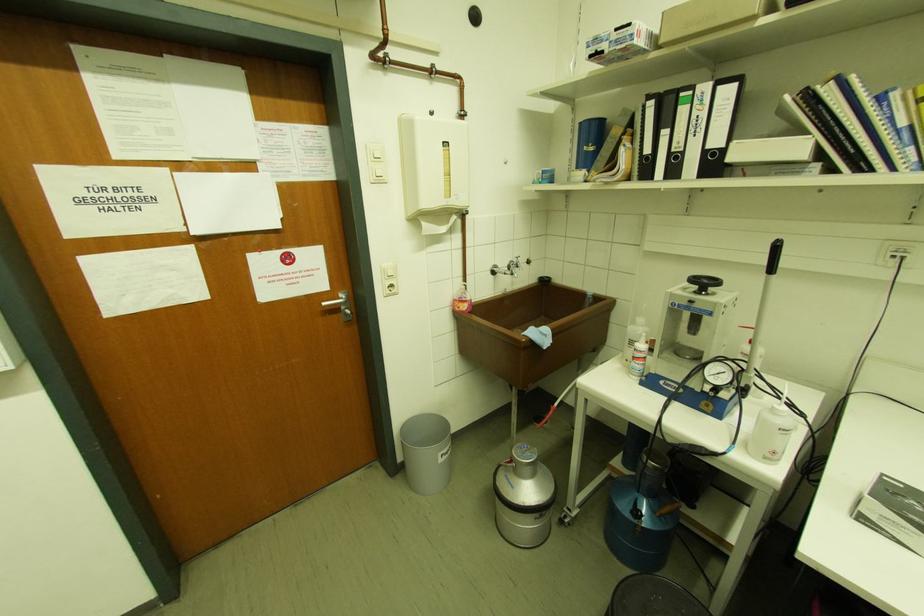
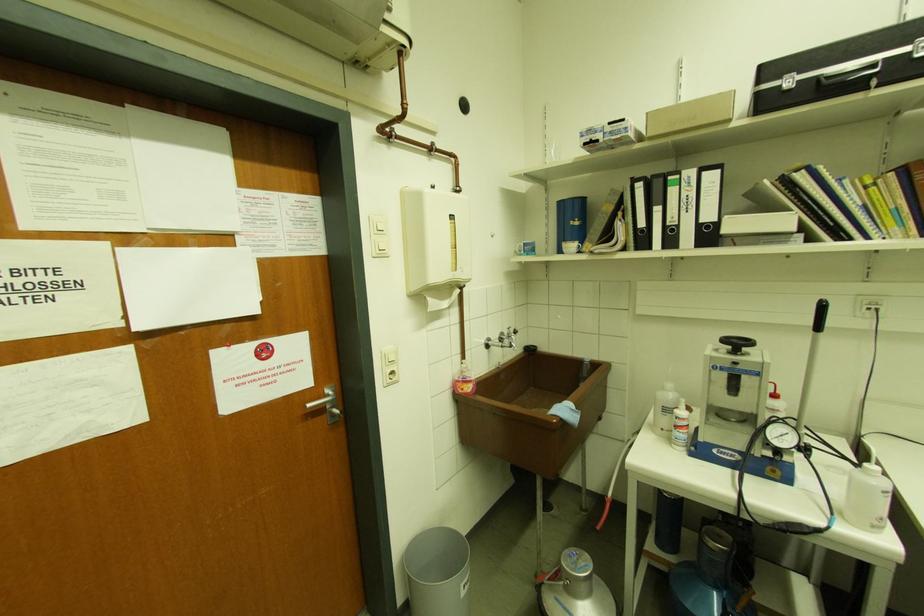
The point at (386, 272) is marked in the first image. Where is the corresponding point in the second image?

(387, 357)